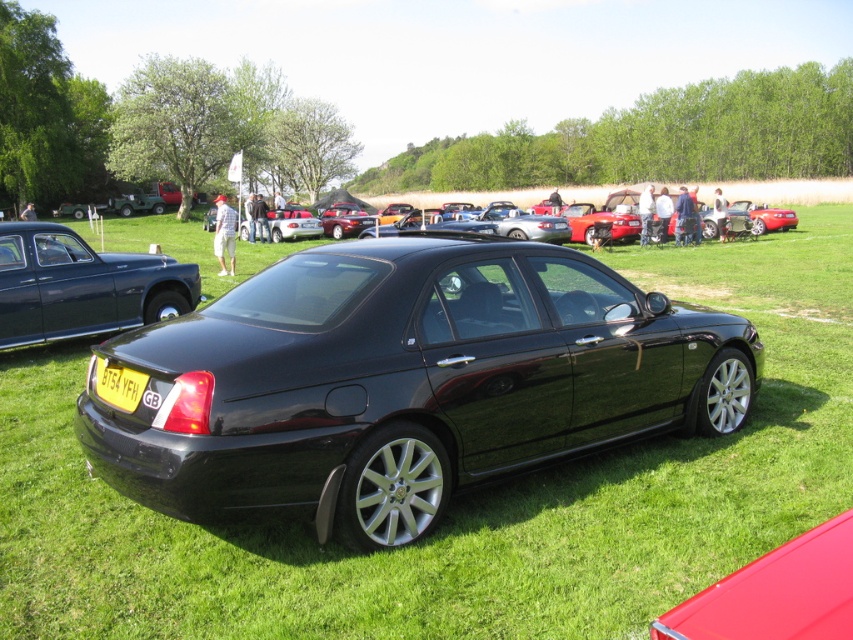
Question: Which point is closer to the camera?

Choices:
 (A) glossy red car at center
 (B) yellow matte license plate at center
 (C) glossy black sedan at center
 (D) shiny black sedan at center

Answer: (A)

Question: Which point is farther from the camera taking this photo?

Choices:
 (A) (236, 346)
 (B) (814, 552)
 (C) (129, 376)

Answer: (C)

Question: Does glossy black sedan at center lie in front of glossy red car at center?

Choices:
 (A) no
 (B) yes

Answer: (A)

Question: From the image, what is the correct spatial relationship of glossy black sedan at center in relation to yellow matte license plate at center?

Choices:
 (A) left
 (B) right

Answer: (B)

Question: Does shiny black sedan at center appear under yellow matte license plate at center?

Choices:
 (A) yes
 (B) no

Answer: (B)

Question: Estimate the real-world distances between objects in this image. Which object is closer to the glossy red car at center?

Choices:
 (A) shiny black sedan at center
 (B) yellow matte license plate at center
 (C) glossy black sedan at center

Answer: (C)